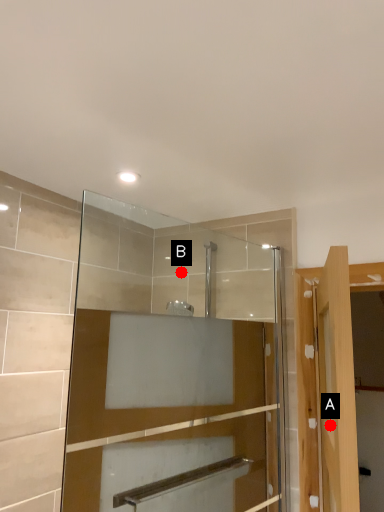
Question: Two points are circled on the image, labeled by A and B beside each circle. Among these points, which one is nearest to the camera?

Choices:
 (A) A is closer
 (B) B is closer

Answer: (A)